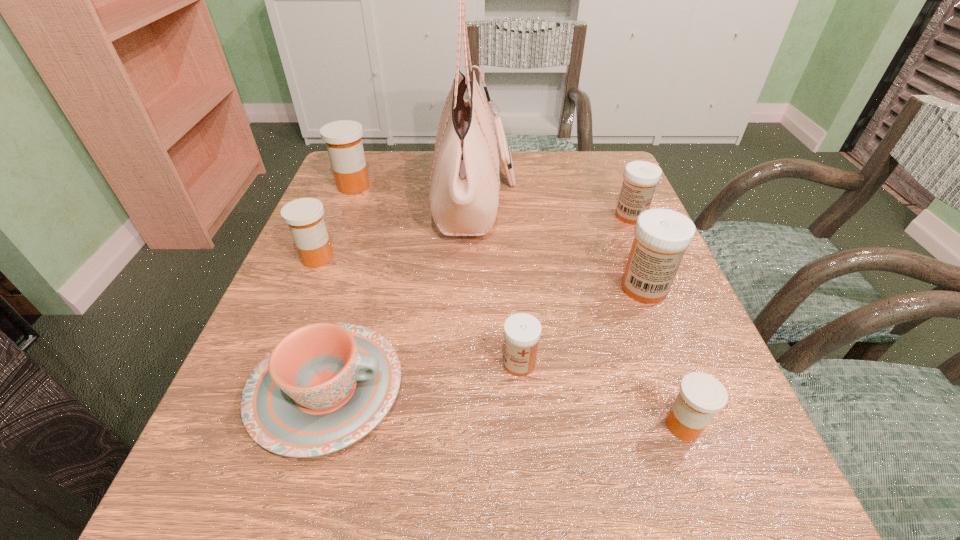
Where is `free space that satisfies the following two spatial constraints: 1. on the label of the biggest orange medicine; 2. on the right side of the second smallest white medicine`? The height and width of the screenshot is (540, 960). free space that satisfies the following two spatial constraints: 1. on the label of the biggest orange medicine; 2. on the right side of the second smallest white medicine is located at coordinates (342, 216).

What are the coordinates of `free spot that satisfies the following two spatial constraints: 1. on the back side of the biggest white medicine; 2. on the left side of the farthest white medicine` in the screenshot? It's located at (616, 216).

Identify the location of vacant area in the image that satisfies the following two spatial constraints: 1. on the label of the nearest white medicine; 2. on the left side of the second smallest orange medicine. (274, 363).

Image resolution: width=960 pixels, height=540 pixels. I want to click on blank space that satisfies the following two spatial constraints: 1. on the label of the second smallest orange medicine; 2. on the left side of the fifth farthest medicine, so click(x=274, y=363).

Find the location of a particular element. free spot that satisfies the following two spatial constraints: 1. on the side of the tallest object with the attached pouch; 2. on the left side of the fifth farthest object is located at coordinates (474, 288).